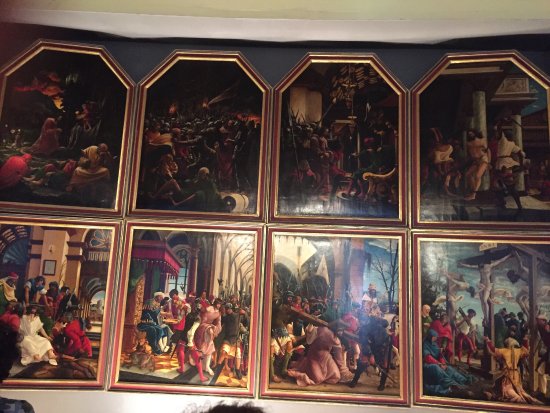
Find the location of `chest`. chest is located at coordinates (475, 145).